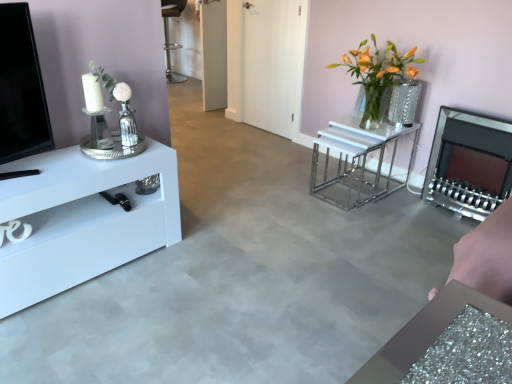
Question: Is point (462, 183) positioned closer to the camera than point (379, 107)?

Choices:
 (A) closer
 (B) farther

Answer: (A)

Question: In terms of height, does matte black fireplace at right look taller or shorter compared to clear glass vase at center?

Choices:
 (A) tall
 (B) short

Answer: (A)

Question: Considering the real-world distances, which object is farthest from the white glossy nesting tables at center, which is counted as the second table, starting from the front?

Choices:
 (A) clear glass vase at center
 (B) translucent glass vase at center right
 (C) matte black fireplace at right
 (D) metallic silver stool at center
 (E) white glossy door at center

Answer: (D)

Question: Based on their relative distances, which object is nearer to the white glossy tv stand at left, acting as the first table starting from the left?

Choices:
 (A) white glossy door at center
 (B) translucent glass vase at center right
 (C) white glossy nesting tables at center, arranged as the first table when viewed from the right
 (D) clear glass vase at center
 (E) metallic silver stool at center

Answer: (C)